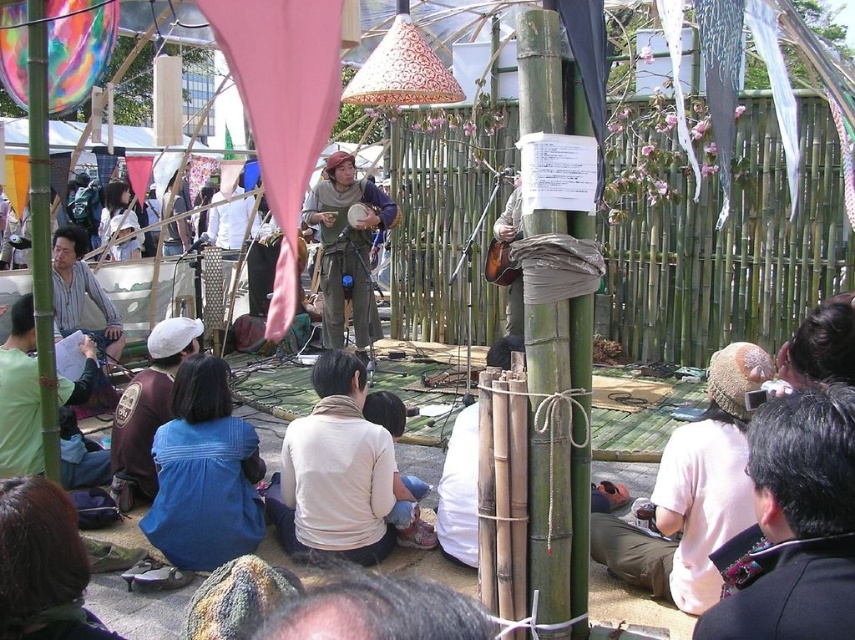
Question: Can you confirm if green bamboo pole at center is positioned below dark brown leather jacket at lower left?

Choices:
 (A) yes
 (B) no

Answer: (A)

Question: Estimate the real-world distances between objects in this image. Which object is closer to the dark brown suit at lower right?

Choices:
 (A) green bamboo pole at left
 (B) brown cotton shirt at lower left
 (C) green bamboo pole at center

Answer: (C)

Question: Among these objects, which one is nearest to the camera?

Choices:
 (A) brown cotton shirt at lower left
 (B) green bamboo pole at center
 (C) green bamboo pole at left

Answer: (B)

Question: Is green canvas pants at center to the left of brown cotton shirt at lower left from the viewer's perspective?

Choices:
 (A) no
 (B) yes

Answer: (A)

Question: Is green bamboo pole at center to the left of green bamboo pole at left from the viewer's perspective?

Choices:
 (A) yes
 (B) no

Answer: (B)

Question: Which is nearer to the green bamboo pole at left?

Choices:
 (A) dark brown suit at lower right
 (B) green bamboo pole at center
 (C) dark brown leather jacket at lower left
 (D) brown cotton shirt at lower left

Answer: (D)